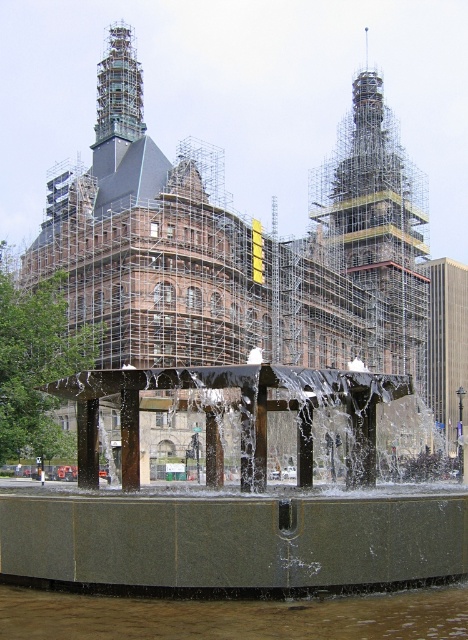
You are standing in front of the building and want to take a photo. There are two points marked in the image at coordinates point (284, 369) and point (292, 621). Which point should you focus on first if you want to ensure both points are in focus?

You should focus on point (284, 369) first because it is closer to the camera than point (292, 621), ensuring both points will be in focus when focused on the closer one.

You are standing at the entrance of the building and want to locate the green stone fountain at center. According to the coordinates provided, in which direction should you move relative to the building?

The green stone fountain at center is located at coordinates approximately 0.786 on the x and 0.498 on the y. Since the entrance is typically at the front of the building, which would be facing the viewer, moving towards the center coordinates would mean moving forward and slightly to the right relative to the building.